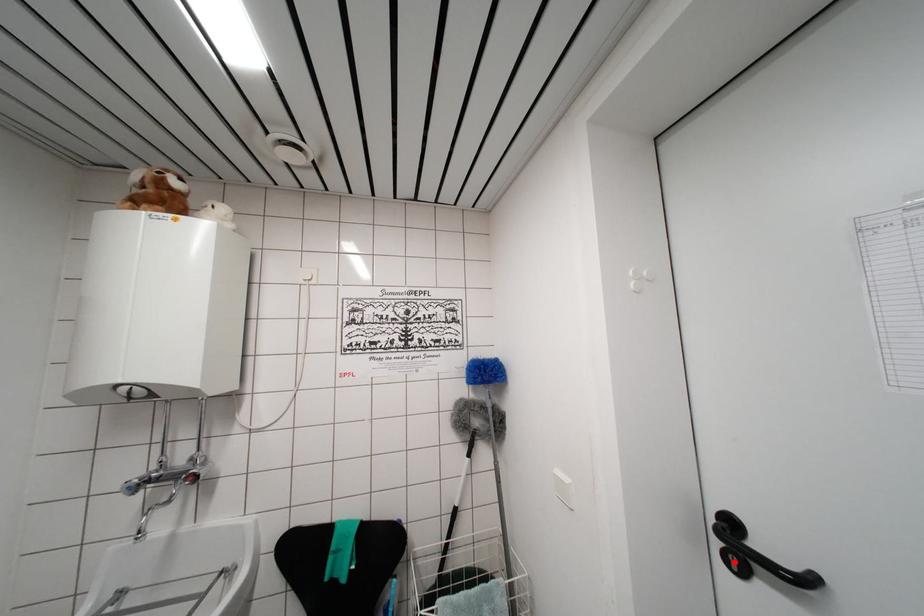
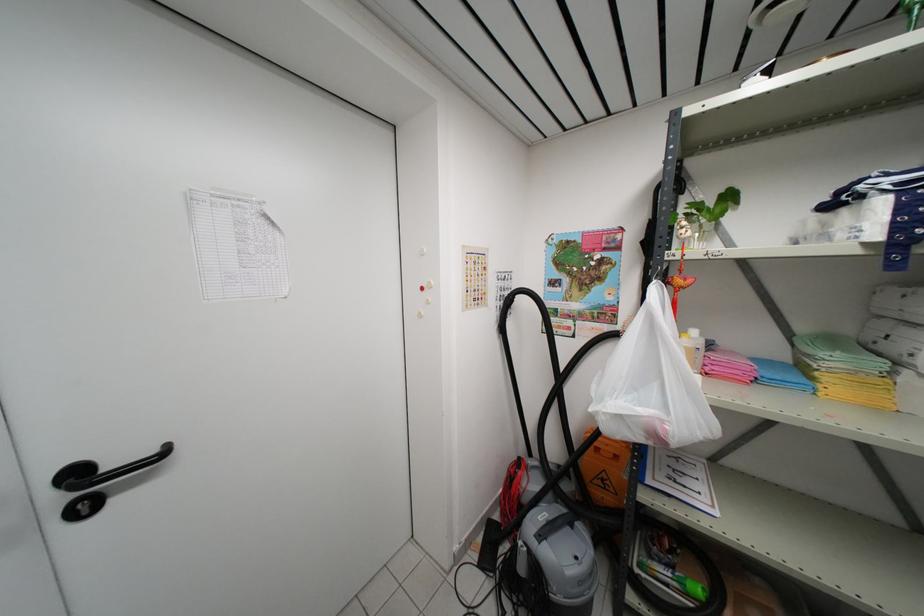
Question: I am providing you with two images of the same scene from different viewpoints. In image1, a red point is highlighted. Considering the same 3D point in image2, which of the following is correct?

Choices:
 (A) It is closer
 (B) It is farther

Answer: (A)